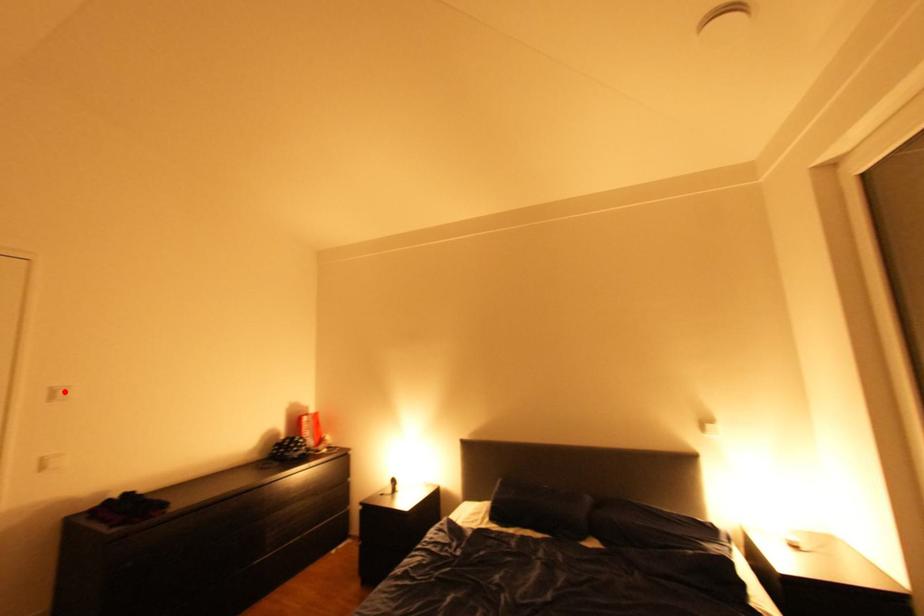
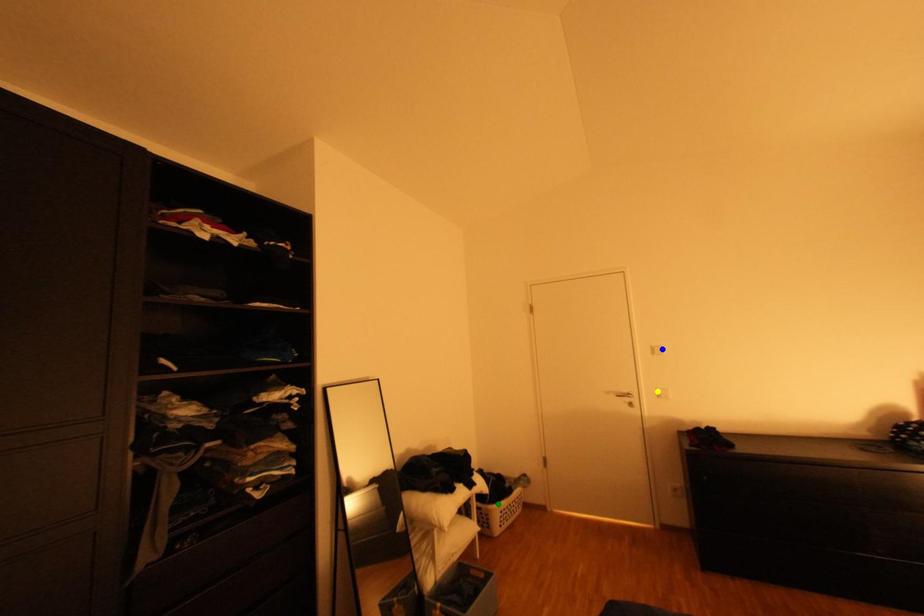
Question: I am providing you with two images of the same scene from different viewpoints. A red point is marked on the first image. You are given multiple points on the second image. Which point in image 2 represents the same 3d spot as the red point in image 1?

Choices:
 (A) green point
 (B) yellow point
 (C) blue point

Answer: (C)